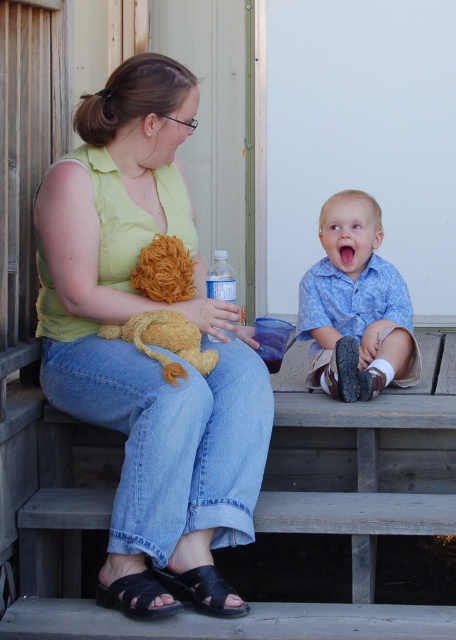
Can you confirm if fluffy yellow stuffed animal at center is positioned to the right of black suede sandal at lower center?

Indeed, fluffy yellow stuffed animal at center is positioned on the right side of black suede sandal at lower center.

From the picture: Which of these two, fluffy yellow stuffed animal at center or black suede sandal at lower center, stands taller?

fluffy yellow stuffed animal at center

Describe the element at coordinates (165, 340) in the screenshot. I see `fluffy yellow stuffed animal at center` at that location.

Where is `fluffy yellow stuffed animal at center`? Image resolution: width=456 pixels, height=640 pixels. fluffy yellow stuffed animal at center is located at coordinates (165, 340).

Who is positioned more to the left, matte yellow shirt at center or clear plastic bottle at center?

matte yellow shirt at center

Which is behind, point (167, 125) or point (228, 278)?

The point (228, 278) is more distant.

The width and height of the screenshot is (456, 640). What are the coordinates of `matte yellow shirt at center` in the screenshot? It's located at (138, 310).

Locate an element on the screen. Image resolution: width=456 pixels, height=640 pixels. matte yellow shirt at center is located at coordinates (138, 310).

Does blue cotton shirt at lower right have a greater width compared to black suede sandal at lower center?

Correct, the width of blue cotton shirt at lower right exceeds that of black suede sandal at lower center.

Is blue cotton shirt at lower right to the left of black suede sandal at lower center from the viewer's perspective?

Incorrect, blue cotton shirt at lower right is not on the left side of black suede sandal at lower center.

Is point (366, 300) closer to viewer compared to point (105, 605)?

No, it is behind (105, 605).

This screenshot has width=456, height=640. I want to click on blue cotton shirt at lower right, so click(x=356, y=305).